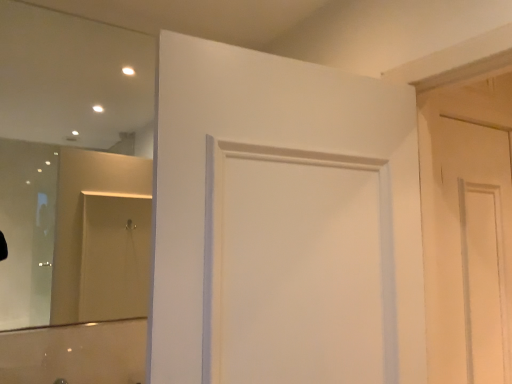
Measure the distance between white matte door at right, the 2th door positioned from the left, and camera.

The depth of white matte door at right, the 2th door positioned from the left, is 4.57 feet.

What do you see at coordinates (71, 78) in the screenshot? The width and height of the screenshot is (512, 384). I see `clear glass mirror at upper left` at bounding box center [71, 78].

The height and width of the screenshot is (384, 512). Identify the location of white matte door at center, acting as the 1th door starting from the front. (272, 145).

Are white matte door at right, placed as the first door when sorted from back to front, and clear glass mirror at upper left far apart?

Yes, white matte door at right, placed as the first door when sorted from back to front, and clear glass mirror at upper left are quite far apart.

Visually, is white matte door at right, the second door from the front, positioned to the left or to the right of clear glass mirror at upper left?

white matte door at right, the second door from the front, is to the right of clear glass mirror at upper left.

This screenshot has height=384, width=512. In order to click on mirror on the left side of white matte door at right, the 2th door positioned from the left in this screenshot , I will do `click(71, 78)`.

Is white matte door at right, the 2th door positioned from the left, surrounding clear glass mirror at upper left?

No, white matte door at right, the 2th door positioned from the left, does not contain clear glass mirror at upper left.

From the image's perspective, which object appears higher, white matte door at right, the second door from the front, or white matte door at center, the 2th door positioned from the right?

white matte door at center, the 2th door positioned from the right, appears higher in the image.

Is white matte door at right, placed as the first door when sorted from right to left, inside or outside of white matte door at center, the first door viewed from the left?

white matte door at right, placed as the first door when sorted from right to left, is not enclosed by white matte door at center, the first door viewed from the left.

Is white matte door at right, the second door from the front, positioned far away from white matte door at center, the first door viewed from the left?

white matte door at right, the second door from the front, is near white matte door at center, the first door viewed from the left, not far away.

How different are the orientations of white matte door at right, the 2th door positioned from the left, and white matte door at center, acting as the 1th door starting from the front, in degrees?

There is a 2.76-degree angle between the facing directions of white matte door at right, the 2th door positioned from the left, and white matte door at center, acting as the 1th door starting from the front.

Would you consider clear glass mirror at upper left to be distant from white matte door at right, the second door from the front?

Yes, clear glass mirror at upper left is far from white matte door at right, the second door from the front.

From the image's perspective, is clear glass mirror at upper left beneath white matte door at right, the second door from the front?

No, from the image's perspective, clear glass mirror at upper left is not below white matte door at right, the second door from the front.

Can you confirm if clear glass mirror at upper left is bigger than white matte door at right, placed as the first door when sorted from right to left?

Indeed, clear glass mirror at upper left has a larger size compared to white matte door at right, placed as the first door when sorted from right to left.

Can you confirm if white matte door at center, the 2th door positioned from the right, is bigger than clear glass mirror at upper left?

Indeed, white matte door at center, the 2th door positioned from the right, has a larger size compared to clear glass mirror at upper left.

From the image's perspective, between white matte door at center, which ranks as the second door in back-to-front order, and clear glass mirror at upper left, who is located below?

white matte door at center, which ranks as the second door in back-to-front order, from the image's perspective.

Is white matte door at center, the 2th door positioned from the right, completely or partially outside of clear glass mirror at upper left?

Yes, white matte door at center, the 2th door positioned from the right, is outside of clear glass mirror at upper left.

Between white matte door at center, the 2th door positioned from the right, and white matte door at right, placed as the first door when sorted from back to front, which one has more height?

white matte door at right, placed as the first door when sorted from back to front, is taller.

Is white matte door at center, the first door viewed from the left, at the left side of white matte door at right, placed as the first door when sorted from back to front?

Correct, you'll find white matte door at center, the first door viewed from the left, to the left of white matte door at right, placed as the first door when sorted from back to front.

Considering the relative sizes of white matte door at center, which ranks as the second door in back-to-front order, and white matte door at right, the second door from the front, in the image provided, is white matte door at center, which ranks as the second door in back-to-front order, smaller than white matte door at right, the second door from the front,?

No.

How much distance is there between white matte door at center, the 2th door positioned from the right, and white matte door at right, placed as the first door when sorted from right to left?

white matte door at center, the 2th door positioned from the right, and white matte door at right, placed as the first door when sorted from right to left, are 24.30 inches apart from each other.

Which is more to the right, clear glass mirror at upper left or white matte door at center, acting as the 1th door starting from the front?

white matte door at center, acting as the 1th door starting from the front, is more to the right.

Between clear glass mirror at upper left and white matte door at center, acting as the 1th door starting from the front, which one is positioned behind?

Positioned behind is clear glass mirror at upper left.

From a real-world perspective, starting from the clear glass mirror at upper left, which door is the 1st one below it? Please provide its 2D coordinates.

[(272, 145)]

The image size is (512, 384). Find the location of `mirror in front of the white matte door at right, the second door from the front`. mirror in front of the white matte door at right, the second door from the front is located at coordinates (71, 78).

Identify the location of door above the white matte door at right, placed as the first door when sorted from right to left (from the image's perspective). Image resolution: width=512 pixels, height=384 pixels. (272, 145).

Considering their positions, is white matte door at right, the 2th door positioned from the left, positioned further to clear glass mirror at upper left than white matte door at center, the 2th door positioned from the right?

The object further to clear glass mirror at upper left is white matte door at right, the 2th door positioned from the left.

Looking at the image, which one is located closer to clear glass mirror at upper left, white matte door at center, which ranks as the second door in back-to-front order, or white matte door at right, placed as the first door when sorted from back to front?

white matte door at center, which ranks as the second door in back-to-front order, is closer to clear glass mirror at upper left.

Which object lies further to the anchor point white matte door at center, acting as the 1th door starting from the front, white matte door at right, the second door from the front, or clear glass mirror at upper left?

clear glass mirror at upper left is positioned further to the anchor white matte door at center, acting as the 1th door starting from the front.

Estimate the real-world distances between objects in this image. Which object is further from white matte door at right, placed as the first door when sorted from right to left, clear glass mirror at upper left or white matte door at center, the 2th door positioned from the right?

The object further to white matte door at right, placed as the first door when sorted from right to left, is clear glass mirror at upper left.

Considering their positions, is clear glass mirror at upper left positioned further to white matte door at center, the 2th door positioned from the right, than white matte door at right, placed as the first door when sorted from right to left?

clear glass mirror at upper left is positioned further to the anchor white matte door at center, the 2th door positioned from the right.

Based on the photo, considering their positions, is white matte door at center, which ranks as the second door in back-to-front order, positioned closer to white matte door at right, placed as the first door when sorted from right to left, than clear glass mirror at upper left?

white matte door at center, which ranks as the second door in back-to-front order, is positioned closer to the anchor white matte door at right, placed as the first door when sorted from right to left.

The height and width of the screenshot is (384, 512). I want to click on door between clear glass mirror at upper left and white matte door at right, the second door from the front, from left to right, so click(x=272, y=145).